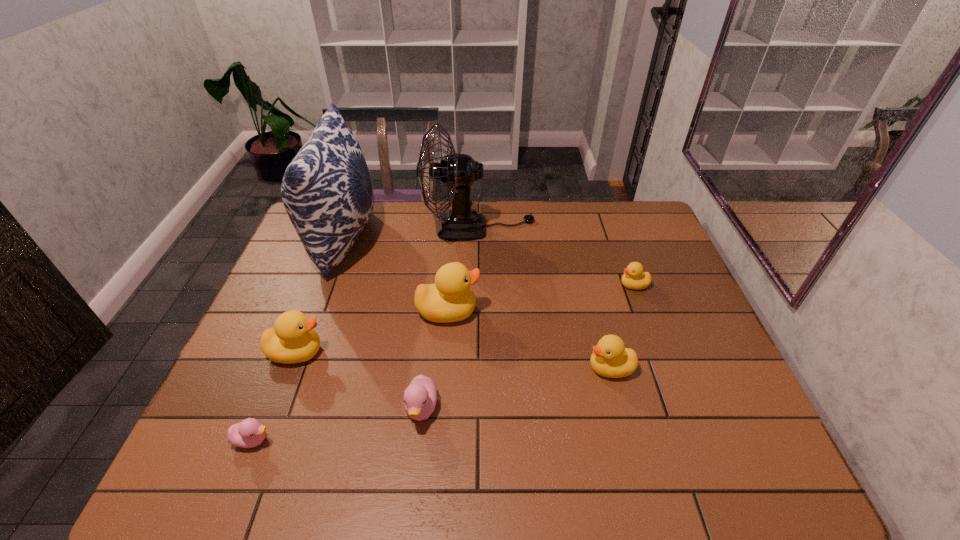
I want to click on the rightmost yellow duckling, so click(x=634, y=278).

Image resolution: width=960 pixels, height=540 pixels. In order to click on the smaller pink duckling in this screenshot , I will do click(249, 433).

The height and width of the screenshot is (540, 960). What are the coordinates of `vacant space positioned on the front surface of the blue cushion` in the screenshot? It's located at (474, 239).

Where is `blank space located in front of the fan, indicating the direction of air flow`? The width and height of the screenshot is (960, 540). blank space located in front of the fan, indicating the direction of air flow is located at coordinates (575, 228).

Identify the location of vacant area situated on the face of the sixth shortest object. Image resolution: width=960 pixels, height=540 pixels. (508, 311).

Where is `free region located on the face of the fifth shortest duckling`? The width and height of the screenshot is (960, 540). free region located on the face of the fifth shortest duckling is located at coordinates (375, 352).

Find the location of a particular element. free space located 0.300m on the face of the second yellow duckling from right to left is located at coordinates (467, 368).

The width and height of the screenshot is (960, 540). I want to click on vacant area located 0.190m on the face of the second yellow duckling from right to left, so click(511, 368).

Find the location of a particular element. The image size is (960, 540). free region located on the face of the second yellow duckling from right to left is located at coordinates click(x=475, y=368).

Locate an element on the screen. This screenshot has height=540, width=960. vacant point located on the front-facing side of the bigger pink duckling is located at coordinates (417, 455).